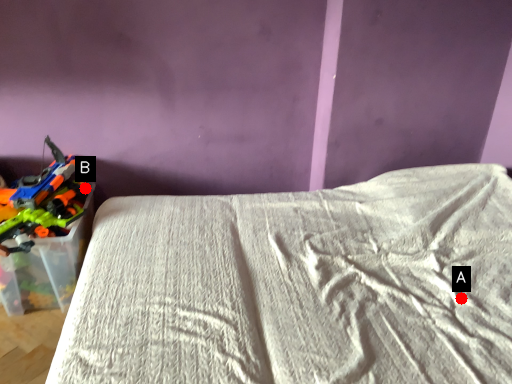
Question: Two points are circled on the image, labeled by A and B beside each circle. Which point is farther to the camera?

Choices:
 (A) A is further
 (B) B is further

Answer: (B)